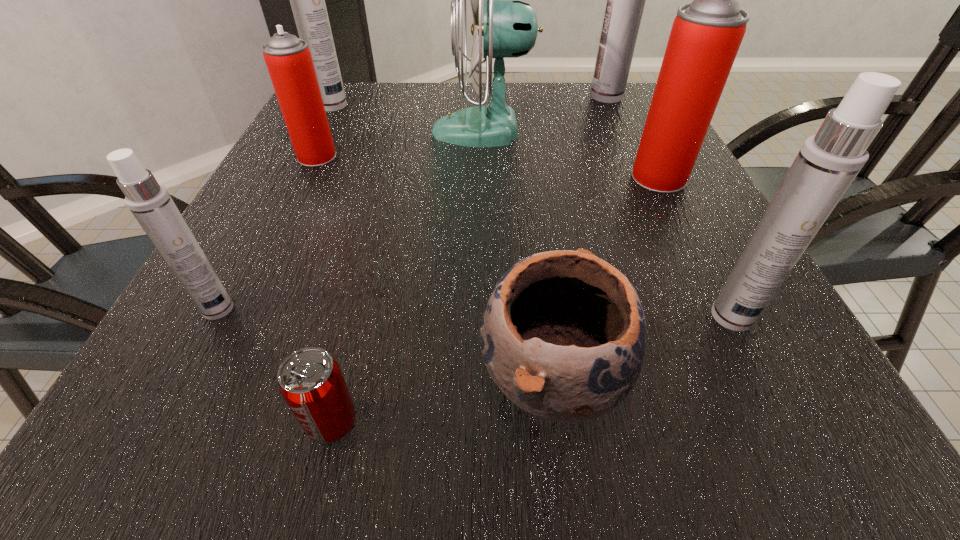
You are a GUI agent. You are given a task and a screenshot of the screen. Output one action in this format:
    pyautogui.click(x=<x>, y=<y>)
    Task: Click on the free point located on the front of the smallest white aerosol can
    Image resolution: width=960 pixels, height=540 pixels.
    Given the screenshot: What is the action you would take?
    (163, 413)

You are a GUI agent. You are given a task and a screenshot of the screen. Output one action in this format:
    pyautogui.click(x=<x>, y=<y>)
    Task: Click on the free space located on the left of the blue pottery
    The height and width of the screenshot is (540, 960).
    Given the screenshot: What is the action you would take?
    pyautogui.click(x=297, y=376)

You are a GUI agent. You are given a task and a screenshot of the screen. Output one action in this format:
    pyautogui.click(x=<x>, y=<y>)
    Task: Click on the vacant space positioned 0.070m on the right of the fourth object from left to right
    
    Given the screenshot: What is the action you would take?
    pyautogui.click(x=414, y=422)

In order to click on fan at the far edge in this screenshot , I will do `click(509, 29)`.

Where is `pottery that is at the near edge`? The height and width of the screenshot is (540, 960). pottery that is at the near edge is located at coordinates (563, 336).

I want to click on soda can present at the near edge, so point(311,382).

The width and height of the screenshot is (960, 540). Find the location of `object that is at the far left corner`. object that is at the far left corner is located at coordinates (307, 0).

You are a GUI agent. You are given a task and a screenshot of the screen. Output one action in this format:
    pyautogui.click(x=<x>, y=<y>)
    Task: Click on the object that is positioned at the far right corner
    
    Given the screenshot: What is the action you would take?
    pyautogui.click(x=625, y=0)

Image resolution: width=960 pixels, height=540 pixels. Find the location of `vacant space at the far edge of the desktop`. vacant space at the far edge of the desktop is located at coordinates (513, 101).

At what (x,y) coordinates should I click in order to perform the action: click on vacant position at the left edge of the desktop. Please return your answer as a coordinate pair (x, y). The height and width of the screenshot is (540, 960). Looking at the image, I should click on 285,284.